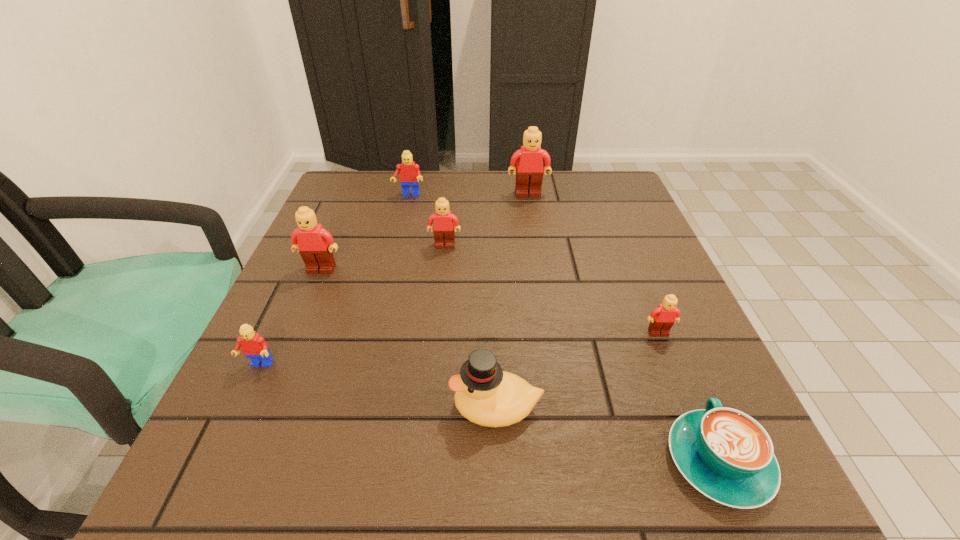
The height and width of the screenshot is (540, 960). What are the coordinates of `free spot that satisfies the following two spatial constraints: 1. on the front-facing side of the duck; 2. with the handle on the right side of the cappuccino` in the screenshot? It's located at (497, 461).

In order to click on blank space that satisfies the following two spatial constraints: 1. on the face of the fifth farthest object; 2. on the front-facing side of the yellow duck in this screenshot , I will do `click(689, 407)`.